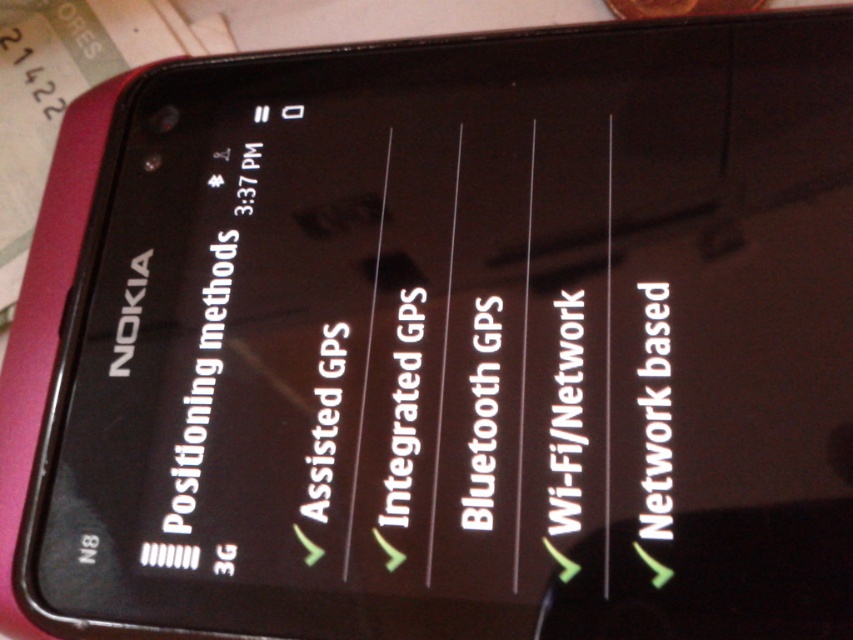
You are using a Nokia smartphone and want to know which text is on the left side between the white text at center and the white glossy text at center. Which one is on the left?

The white glossy text at center is on the left side because the white text at center is to the right of it.

You are holding a Nokia smartphone with a screen size of 5.5 inches. You want to know if the two white texts at the center of the screen are spaced far enough apart so that you can easily distinguish them with your fingers. Based on the information provided, can you determine if the distance between the white text at center and the white glossy text at center is sufficient for easy finger distinction?

The distance between the white text at center and the white glossy text at center is 2.44 inches. Since the smartphone screen is 5.5 inches in size, the spacing between the texts is more than adequate for easy finger distinction as 2.44 inches is a comfortable distance on a 5.5 inch screen.

You are looking at the screen of a Nokia smartphone. You see the black glossy text at center right and the white glossy text at center. Which one is located to the right side?

The black glossy text at center right is located to the right of the white glossy text at center.